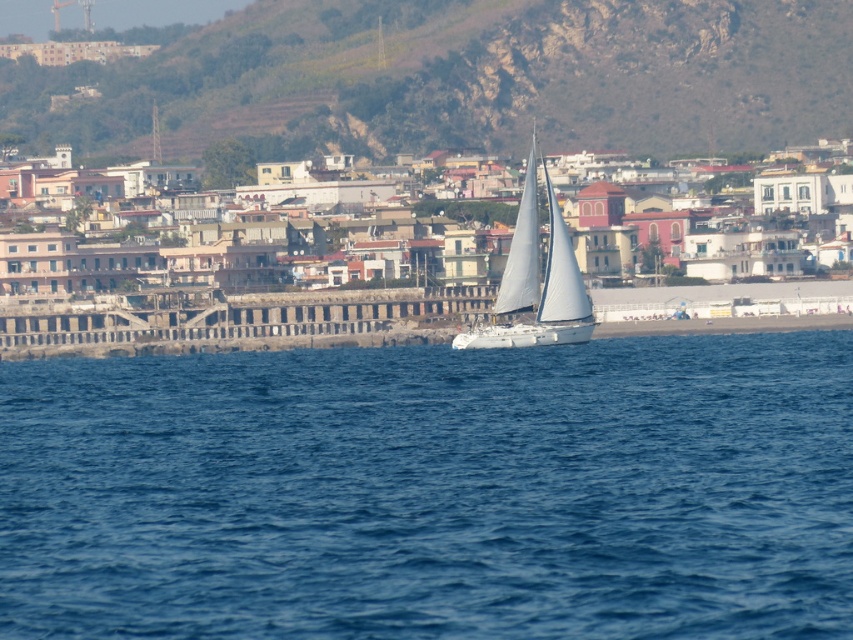
Between blue water at center and white matte sailboat at center, which one appears on the right side from the viewer's perspective?

Positioned to the right is white matte sailboat at center.

Locate an element on the screen. The height and width of the screenshot is (640, 853). blue water at center is located at coordinates (433, 492).

Who is more forward, (718, 554) or (503, 298)?

Positioned in front is point (718, 554).

The image size is (853, 640). What are the coordinates of `blue water at center` in the screenshot? It's located at (433, 492).

Is blue water at center positioned before green grassy hillside at upper center?

Yes, it is.

Find the location of a particular element. The width and height of the screenshot is (853, 640). blue water at center is located at coordinates (433, 492).

Is green grassy hillside at upper center shorter than white matte sailboat at center?

Correct, green grassy hillside at upper center is not as tall as white matte sailboat at center.

Which is behind, point (699, 81) or point (532, 228)?

Positioned behind is point (699, 81).

Which is in front, point (144, 128) or point (514, 268)?

Point (514, 268) is in front.

Find the location of a particular element. This screenshot has height=640, width=853. green grassy hillside at upper center is located at coordinates (465, 77).